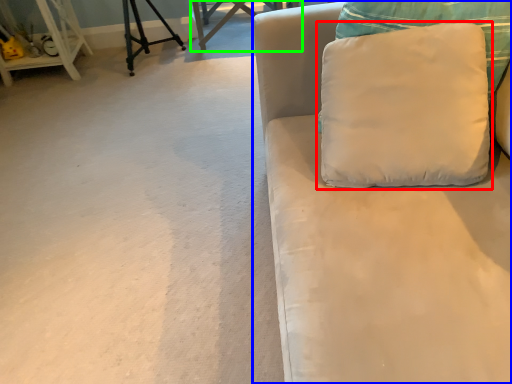
Question: Which is farther away from pillow (highlighted by a red box)? studio couch (highlighted by a blue box) or table (highlighted by a green box)?

Choices:
 (A) studio couch
 (B) table

Answer: (B)